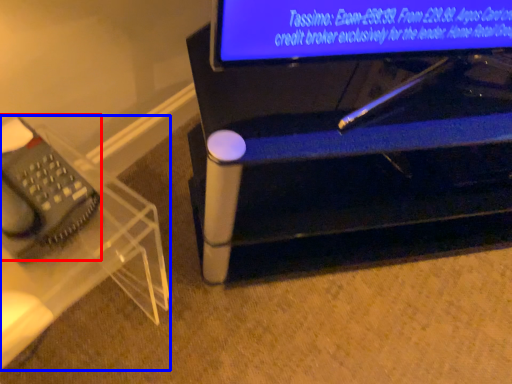
Question: Which of the following is the closest to the observer, equipment (highlighted by a red box) or furniture (highlighted by a blue box)?

Choices:
 (A) equipment
 (B) furniture

Answer: (B)